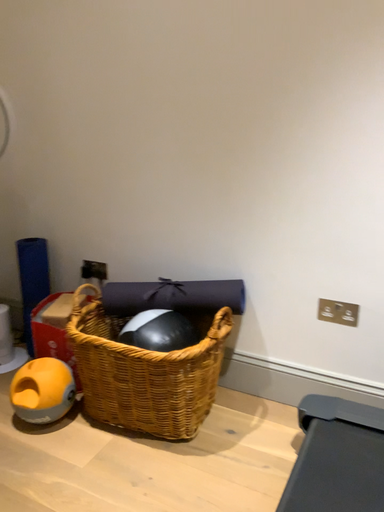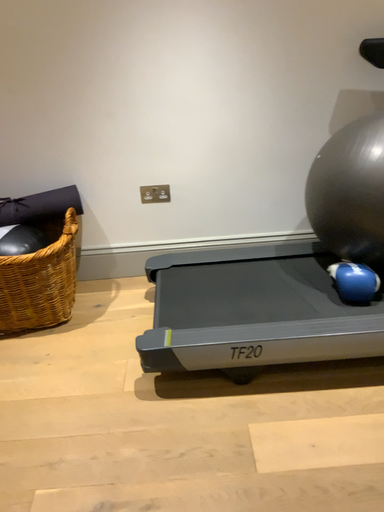
Question: Which way did the camera rotate in the video?

Choices:
 (A) rotated right
 (B) rotated left

Answer: (A)